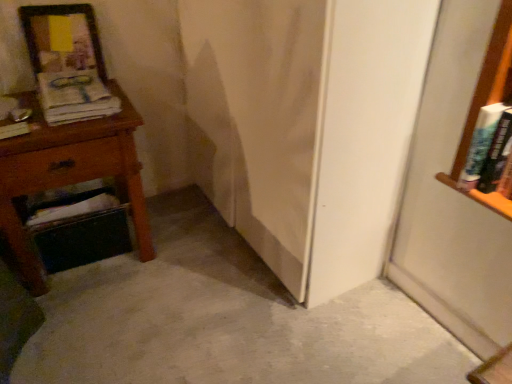
Question: In terms of width, does wooden nightstand at left look wider or thinner when compared to wooden picture frame at upper left?

Choices:
 (A) thin
 (B) wide

Answer: (B)

Question: Considering the positions of point (86, 142) and point (22, 13), is point (86, 142) closer or farther from the camera than point (22, 13)?

Choices:
 (A) closer
 (B) farther

Answer: (A)

Question: Based on their relative distances, which object is nearer to the wooden picture frame at upper left?

Choices:
 (A) matte paper magazine at left
 (B) white glossy screen door at center
 (C) wooden nightstand at left
 (D) hardcover book at left, placed as the first book when sorted from left to right
 (E) hardcover book at right, the 2th book from the left

Answer: (A)

Question: Estimate the real-world distances between objects in this image. Which object is farther from the white glossy screen door at center?

Choices:
 (A) matte paper magazine at left
 (B) wooden picture frame at upper left
 (C) wooden nightstand at left
 (D) hardcover book at left, which ranks as the second book in right-to-left order
 (E) hardcover book at right, the 2th book from the left

Answer: (D)